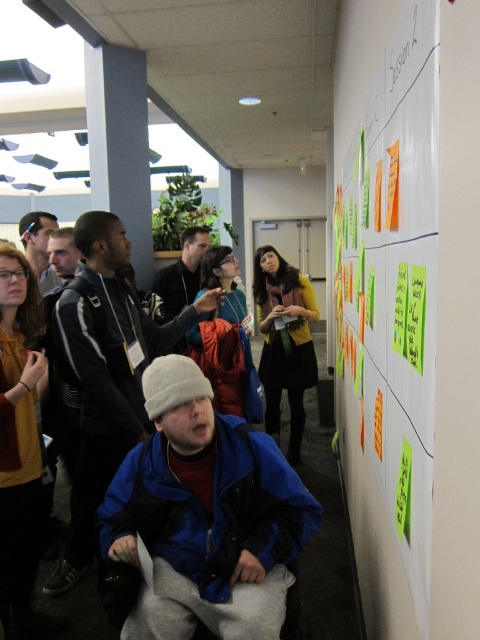
Is black leather jacket at center wider than matte black jacket at upper left?

In fact, black leather jacket at center might be narrower than matte black jacket at upper left.

Is black leather jacket at center to the left of matte black jacket at upper left from the viewer's perspective?

No, black leather jacket at center is not to the left of matte black jacket at upper left.

Which is behind, point (177, 349) or point (46, 280)?

The point (177, 349) is behind.

You are a GUI agent. You are given a task and a screenshot of the screen. Output one action in this format:
    pyautogui.click(x=<x>, y=<y>)
    Task: Click on the black leather jacket at center
    Image resolution: width=480 pixels, height=640 pixels.
    Given the screenshot: What is the action you would take?
    pyautogui.click(x=181, y=273)

Who is positioned more to the left, blue matte jacket at lower left or black leather jacket at center?

black leather jacket at center is more to the left.

From the picture: Does blue matte jacket at lower left have a lesser width compared to black leather jacket at center?

In fact, blue matte jacket at lower left might be wider than black leather jacket at center.

Is point (288, 561) closer to viewer compared to point (172, 307)?

Yes, it is.

Where is `blue matte jacket at lower left`? This screenshot has width=480, height=640. blue matte jacket at lower left is located at coordinates (204, 515).

Is blue fleece jacket at lower center closer to the viewer compared to matte yellow shirt at left?

No, blue fleece jacket at lower center is behind matte yellow shirt at left.

Who is lower down, blue fleece jacket at lower center or matte yellow shirt at left?

matte yellow shirt at left

Is point (101, 388) behind point (20, 448)?

Yes, it is.

The width and height of the screenshot is (480, 640). I want to click on blue fleece jacket at lower center, so click(x=106, y=372).